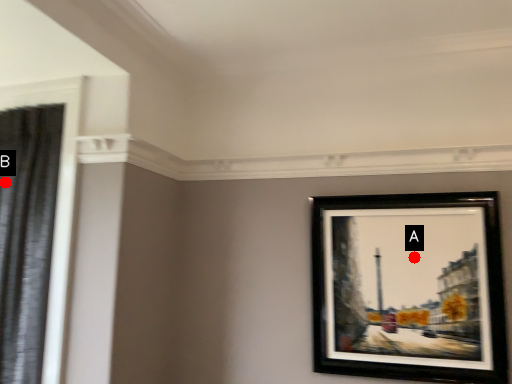
Question: Two points are circled on the image, labeled by A and B beside each circle. Which point is farther to the camera?

Choices:
 (A) A is further
 (B) B is further

Answer: (A)